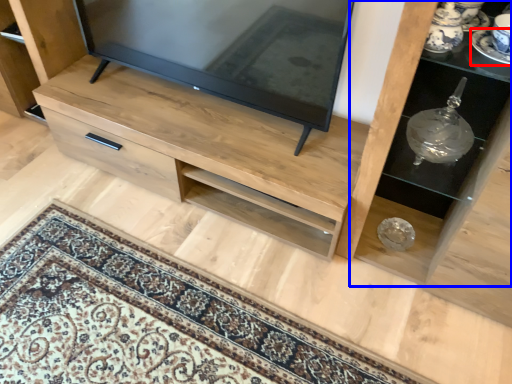
Question: Which object appears closest to the camera in this image, saucer (highlighted by a red box) or shelf (highlighted by a blue box)?

Choices:
 (A) saucer
 (B) shelf

Answer: (B)